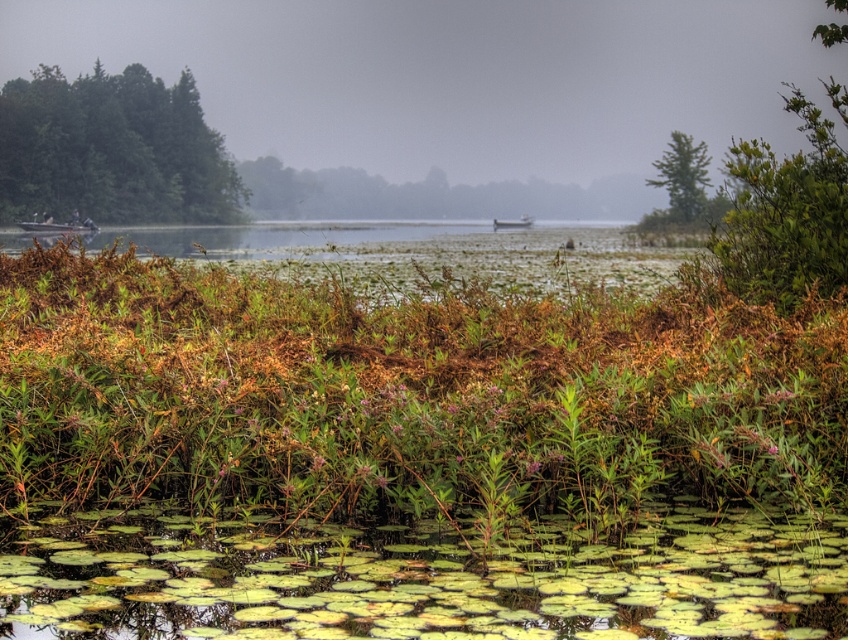
From the picture: You are standing at the lakeside and want to take a photo of the foggy mist at center. Where should you point your camera to capture it?

You should point your camera at point 0.122 on the horizontal axis and 0.537 on the vertical axis to capture the foggy mist at center.

You are an observer standing at the lakeside. You notice the foggy mist at center and the green leafy tree at upper right. Which one appears taller in the scene?

The foggy mist at center appears taller than the green leafy tree at upper right because it has a greater height in the scene.